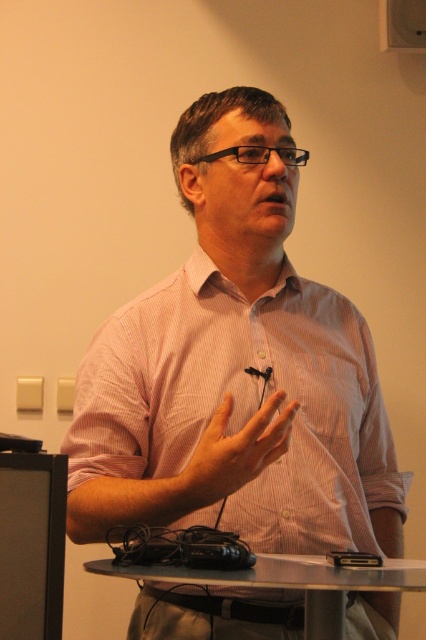
Between point (28, 612) and point (161, 573), which one is positioned behind?

Point (161, 573)

Does black glossy monitor at lower left appear on the left side of metallic gray table at center?

Correct, you'll find black glossy monitor at lower left to the left of metallic gray table at center.

Which is in front, point (17, 579) or point (337, 566)?

Point (17, 579) is more forward.

Locate an element on the screen. The image size is (426, 640). black glossy monitor at lower left is located at coordinates (31, 545).

Is pink striped shirt at center positioned before black glossy monitor at lower left?

That is False.

Between point (342, 529) and point (11, 636), which one is positioned in front?

Positioned in front is point (11, 636).

This screenshot has width=426, height=640. Identify the location of pink striped shirt at center. (236, 371).

Is metallic gray table at center thinner than pale skin/hair at center?

In fact, metallic gray table at center might be wider than pale skin/hair at center.

Can you confirm if metallic gray table at center is positioned to the left of pale skin/hair at center?

In fact, metallic gray table at center is to the right of pale skin/hair at center.

Is point (144, 577) positioned after point (247, 468)?

No, it is not.

Find the location of a particular element. Image resolution: width=426 pixels, height=640 pixels. metallic gray table at center is located at coordinates (293, 582).